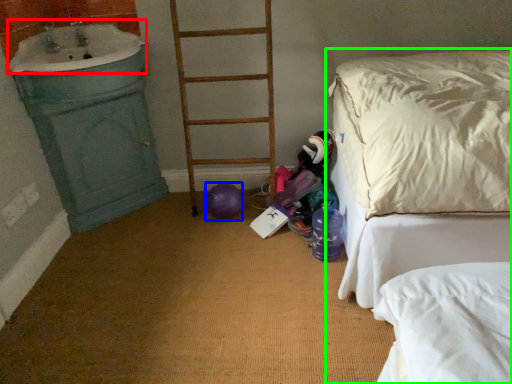
Question: Which object is positioned closest to sink (highlighted by a red box)? Select from balloon (highlighted by a blue box) and bed (highlighted by a green box).

Choices:
 (A) balloon
 (B) bed

Answer: (A)